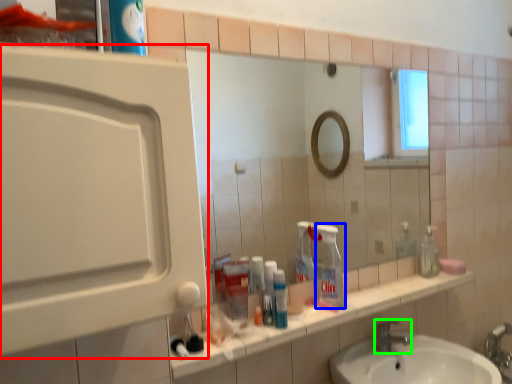
Question: Estimate the real-world distances between objects in this image. Which object is farther from medicine cabinet (highlighted by a red box), cleaning product (highlighted by a blue box) or tap (highlighted by a green box)?

Choices:
 (A) cleaning product
 (B) tap

Answer: (B)